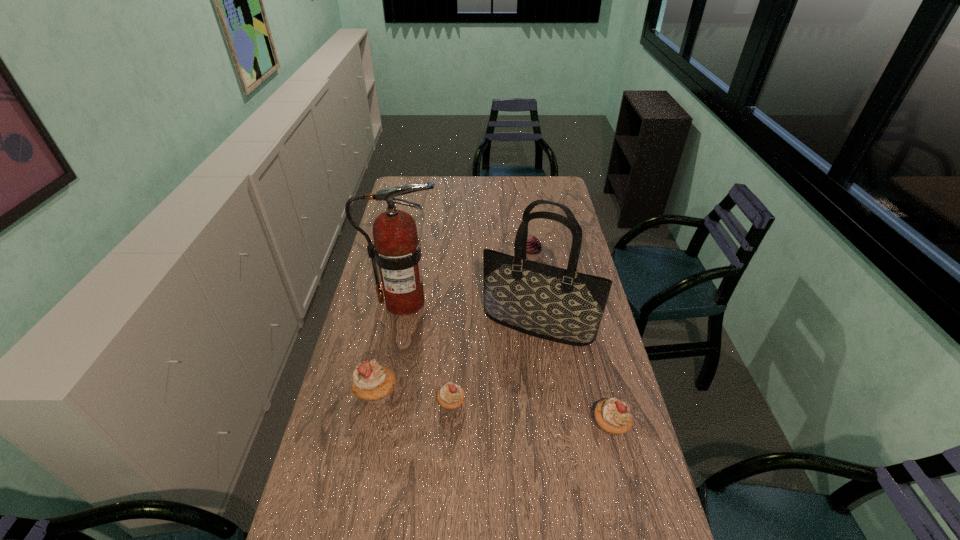
To make them evenly spaced by inserting another cupcake among them, please locate a vacant spot for this new cupcake. Please provide its 2D coordinates. Your answer should be formatted as a tuple, i.e. [(x, y)], where the tuple contains the x and y coordinates of a point satisfying the conditions above.

[(529, 414)]